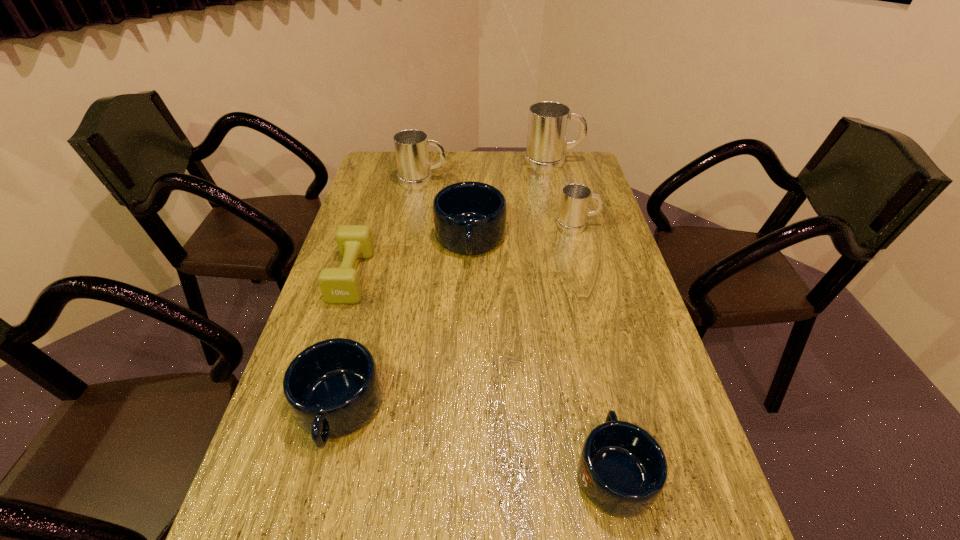
The width and height of the screenshot is (960, 540). Identify the location of the second closest blue mug to the smallest blue mug. pos(469,217).

Where is `vacant point that satisfies the following two spatial constraints: 1. on the side of the leftmost gray mug with the handle; 2. with the handle on the side of the smallest blue mug`? Image resolution: width=960 pixels, height=540 pixels. vacant point that satisfies the following two spatial constraints: 1. on the side of the leftmost gray mug with the handle; 2. with the handle on the side of the smallest blue mug is located at coordinates (370, 470).

Where is `free location that satisfies the following two spatial constraints: 1. on the side of the smallest gray mug with the handle; 2. with the handle on the side of the second blue mug from right to left`? The image size is (960, 540). free location that satisfies the following two spatial constraints: 1. on the side of the smallest gray mug with the handle; 2. with the handle on the side of the second blue mug from right to left is located at coordinates (581, 239).

This screenshot has width=960, height=540. Find the location of `vacant area that satisfies the following two spatial constraints: 1. on the side of the smallest gray mug with the handle; 2. with the handle on the side of the farthest blue mug`. vacant area that satisfies the following two spatial constraints: 1. on the side of the smallest gray mug with the handle; 2. with the handle on the side of the farthest blue mug is located at coordinates (581, 239).

Find the location of a particular element. The height and width of the screenshot is (540, 960). free spot that satisfies the following two spatial constraints: 1. on the side of the nearest gray mug with the handle; 2. with the handle on the side of the second biggest blue mug is located at coordinates (627, 409).